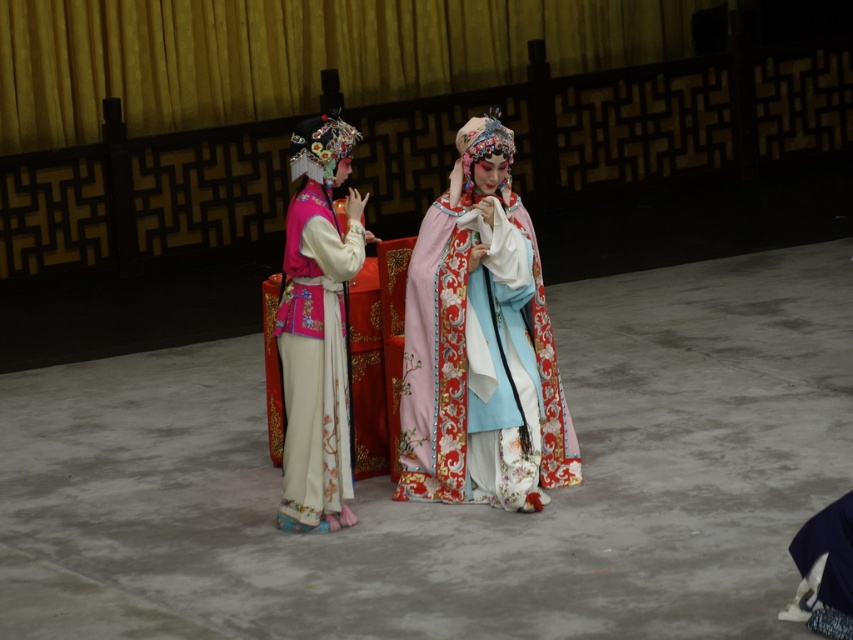
You are an audience member sitting in the front row of the opera. You notice two performers on stage wearing different robes. The silky brocade robe at center and the matte pink silk robe at left. Which robe is positioned closer to the right side of the stage?

The silky brocade robe at center is positioned closer to the right side of the stage compared to the matte pink silk robe at left.

Consider the image. You are an audience member sitting in the front row of the opera. You notice two performers on stage wearing the silky brocade robe at center and the matte pink silk robe at left. Which performer is wearing a robe that appears shorter in height?

The silky brocade robe at center is not as tall as the matte pink silk robe at left, so the performer wearing the silky brocade robe at center has the shorter robe.